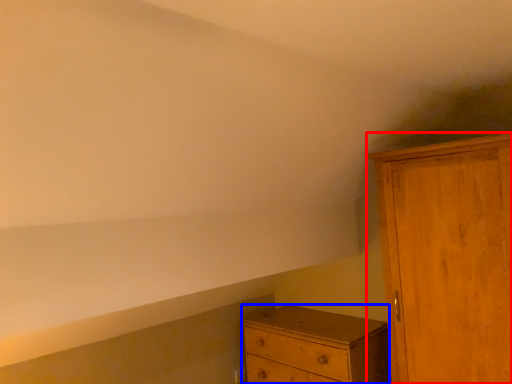
Question: Which object is further to the camera taking this photo, cupboard (highlighted by a red box) or chest of drawers (highlighted by a blue box)?

Choices:
 (A) cupboard
 (B) chest of drawers

Answer: (B)